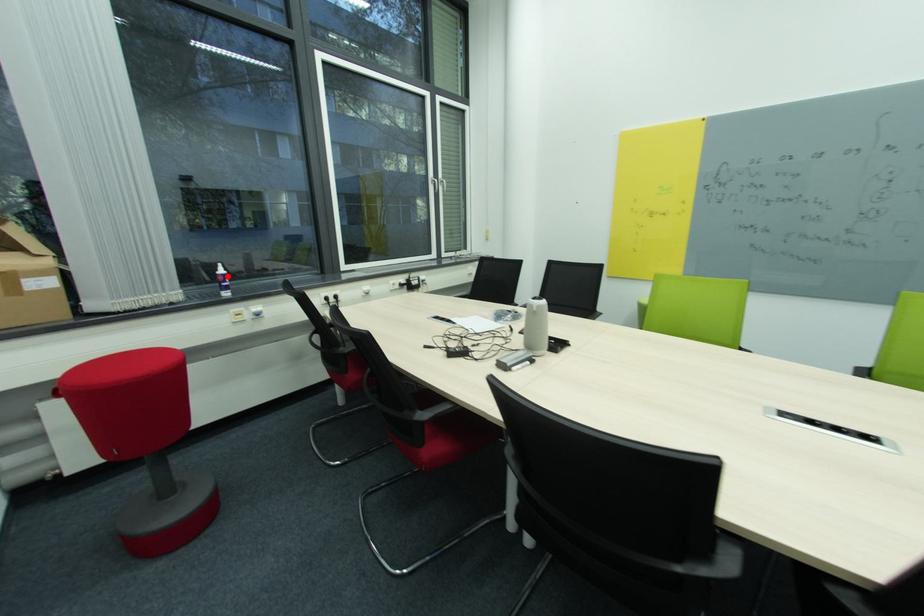
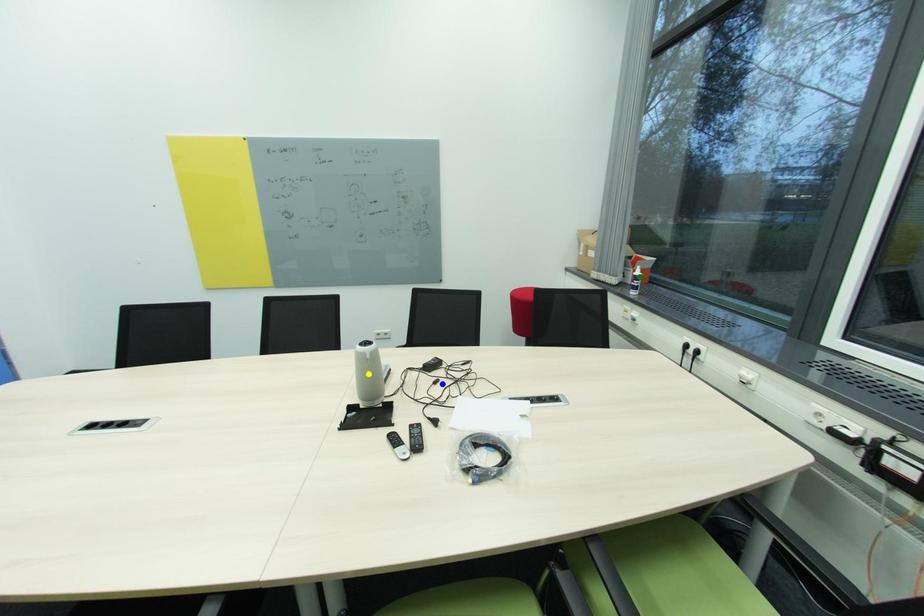
Question: I am providing you with two images of the same scene from different viewpoints. A red point is marked on the first image. You are given multiple points on the second image. Which point in image 2 represents the same 3d spot as the red point in image 1?

Choices:
 (A) green point
 (B) blue point
 (C) yellow point

Answer: (A)